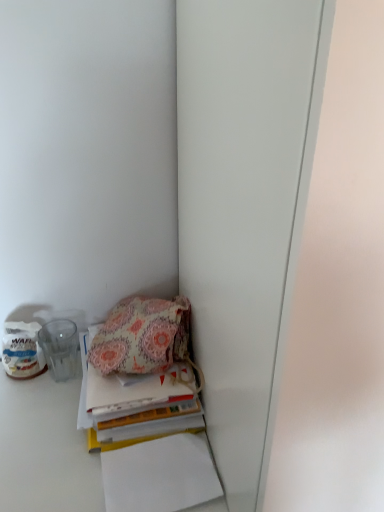
Question: Visually, is floral fabric handbag at lower left positioned to the left or to the right of floral fabric book at lower left?

Choices:
 (A) right
 (B) left

Answer: (B)

Question: Relative to floral fabric book at lower left, is floral fabric handbag at lower left in front or behind?

Choices:
 (A) behind
 (B) front

Answer: (A)

Question: From the image's perspective, is floral fabric handbag at lower left located above or below floral fabric book at lower left?

Choices:
 (A) below
 (B) above

Answer: (B)

Question: Considering the relative positions of floral fabric book at lower left and floral fabric handbag at lower left in the image provided, is floral fabric book at lower left to the left or to the right of floral fabric handbag at lower left?

Choices:
 (A) right
 (B) left

Answer: (A)

Question: Is floral fabric book at lower left taller or shorter than floral fabric handbag at lower left?

Choices:
 (A) short
 (B) tall

Answer: (A)

Question: From a real-world perspective, is floral fabric book at lower left positioned above or below floral fabric handbag at lower left?

Choices:
 (A) below
 (B) above

Answer: (A)

Question: Is floral fabric book at lower left bigger or smaller than floral fabric handbag at lower left?

Choices:
 (A) big
 (B) small

Answer: (A)